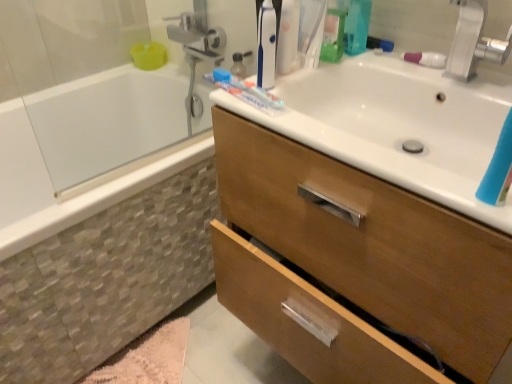
Identify the location of vacant space situated above pink fluffy bath mat at lower left (from a real-world perspective). (169, 361).